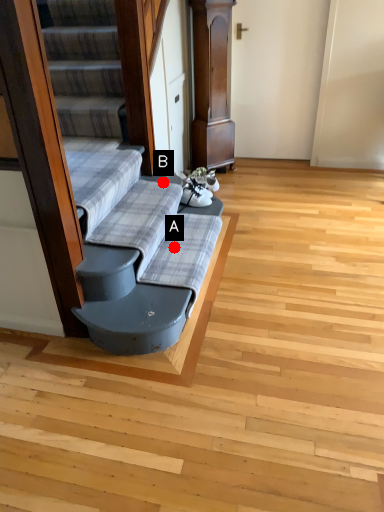
Question: Two points are circled on the image, labeled by A and B beside each circle. Which of the following is the farthest from the observer?

Choices:
 (A) A is further
 (B) B is further

Answer: (B)